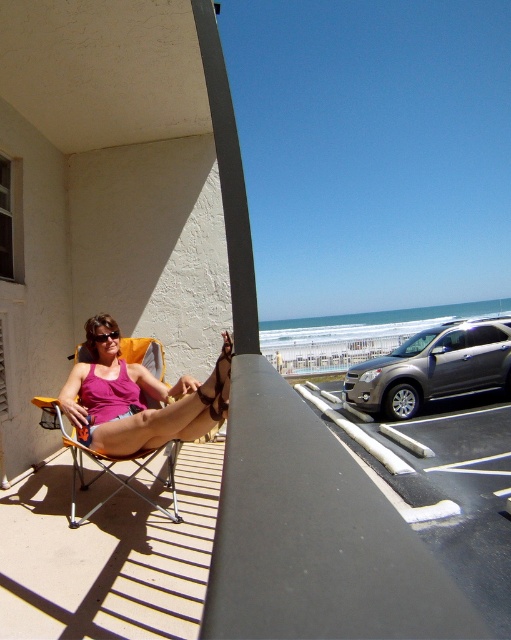
In the scene shown: How distant is matte pink tank top at center from orange fabric chair at center?

11.84 inches

Which of these two, matte pink tank top at center or orange fabric chair at center, stands taller?

matte pink tank top at center

You are a GUI agent. You are given a task and a screenshot of the screen. Output one action in this format:
    pyautogui.click(x=<x>, y=<y>)
    Task: Click on the matte pink tank top at center
    
    Given the screenshot: What is the action you would take?
    pyautogui.click(x=137, y=397)

I want to click on matte pink tank top at center, so click(x=137, y=397).